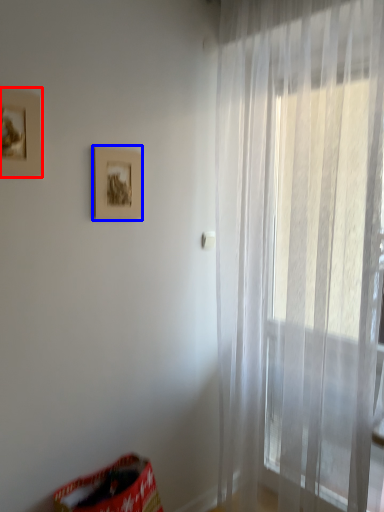
Question: Among these objects, which one is farthest to the camera, picture frame (highlighted by a red box) or picture frame (highlighted by a blue box)?

Choices:
 (A) picture frame
 (B) picture frame

Answer: (B)